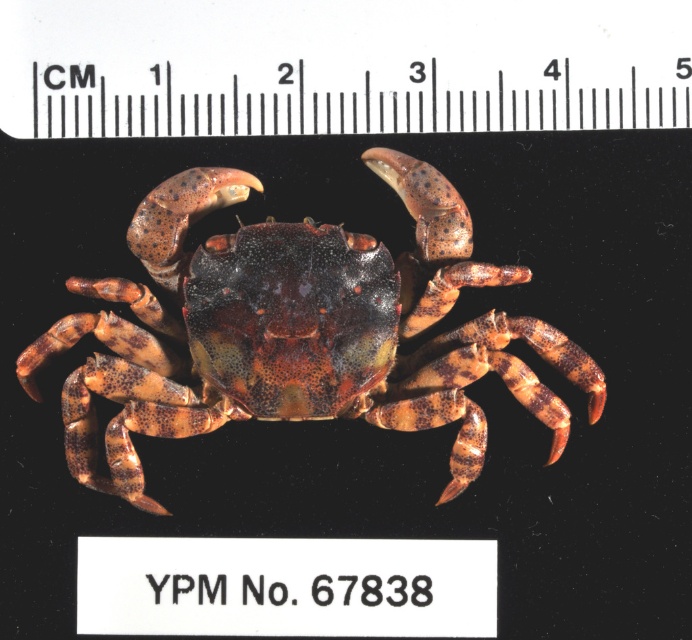
You are a biologist measuring the distance between the speckled brown crab at center and the black plastic ruler at upper center for a study. According to the image, how far apart are these two objects?

The speckled brown crab at center and the black plastic ruler at upper center are 10.23 inches apart from each other.